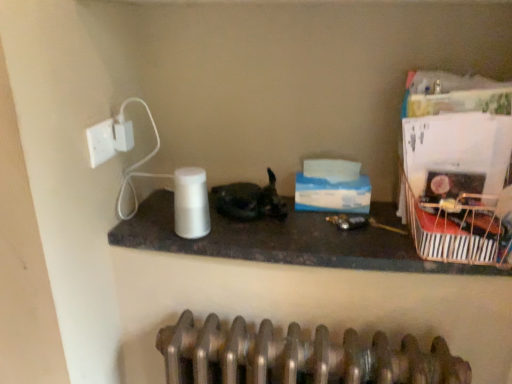
At what (x,y) coordinates should I click in order to perform the action: click on white matte paper towel at center. Please return your answer as a coordinate pair (x, y). Looking at the image, I should click on (191, 203).

In order to face white plastic electric outlet at upper left, should I rotate leftwards or rightwards?

To face it directly, rotate left by 16.937 degrees.

What do you see at coordinates (249, 200) in the screenshot? I see `shiny black cat at center` at bounding box center [249, 200].

Locate an element on the screen. metallic striped basket at right is located at coordinates (455, 230).

Find the location of a particular element. white glossy speaker at center is located at coordinates (287, 240).

At what (x,y) coordinates should I click in order to perform the action: click on basket to the right of white matte paper towel at center. Please return your answer as a coordinate pair (x, y). This screenshot has width=512, height=384. Looking at the image, I should click on pyautogui.click(x=455, y=230).

Is metallic striped basket at right behind white matte paper towel at center?

No, metallic striped basket at right is in front of white matte paper towel at center.

Based on the photo, how many degrees apart are the facing directions of metallic striped basket at right and white matte paper towel at center?

→ The angular difference between metallic striped basket at right and white matte paper towel at center is 0.000851 degrees.

Would you consider metallic striped basket at right to be distant from white matte paper towel at center?

Actually, metallic striped basket at right and white matte paper towel at center are a little close together.

From the image's perspective, would you say white matte paper towel at center is positioned over white plastic socket at upper left?

No, from the image's perspective, white matte paper towel at center is not over white plastic socket at upper left.

Measure the distance from white matte paper towel at center to white plastic socket at upper left.

They are 20.62 centimeters apart.

From a real-world perspective, does white matte paper towel at center sit lower than white plastic socket at upper left?

Yes.

Is white matte paper towel at center in contact with white plastic socket at upper left?

No, white matte paper towel at center is not next to white plastic socket at upper left.

Does metallic striped basket at right turn towards white plastic electric outlet at upper left?

No, metallic striped basket at right does not turn towards white plastic electric outlet at upper left.

Considering the sizes of objects metallic striped basket at right and white plastic electric outlet at upper left in the image provided, who is taller, metallic striped basket at right or white plastic electric outlet at upper left?

metallic striped basket at right is taller.

Does metallic striped basket at right lie in front of white plastic electric outlet at upper left?

Yes, metallic striped basket at right is closer to the viewer.

Visually, is metallic striped basket at right positioned to the left or to the right of white glossy speaker at center?

Based on their positions, metallic striped basket at right is located to the right of white glossy speaker at center.

From a real-world perspective, which object stands above the other?

metallic striped basket at right.

From the image's perspective, which is above, metallic striped basket at right or white glossy speaker at center?

metallic striped basket at right.

Is metallic striped basket at right turned away from white glossy speaker at center?

That's not correct — metallic striped basket at right is not looking away from white glossy speaker at center.

Identify the location of electric outlet that appears above the white plastic socket at upper left (from the image's perspective). (123, 136).

Would you consider white plastic socket at upper left to be distant from white plastic electric outlet at upper left?

No, white plastic socket at upper left is in close proximity to white plastic electric outlet at upper left.

From a real-world perspective, is white plastic socket at upper left over white plastic electric outlet at upper left?

No, from a real-world perspective, white plastic socket at upper left is not above white plastic electric outlet at upper left.

How many degrees apart are the facing directions of shiny black cat at center and white matte paper towel at center?

The facing directions of shiny black cat at center and white matte paper towel at center are 0.00292 degrees apart.

Image resolution: width=512 pixels, height=384 pixels. I want to click on cat above the white matte paper towel at center (from the image's perspective), so click(249, 200).

Would you say shiny black cat at center is a long distance from white matte paper towel at center?

They are positioned close to each other.

Considering the sizes of objects shiny black cat at center and white matte paper towel at center in the image provided, who is bigger, shiny black cat at center or white matte paper towel at center?

With larger size is shiny black cat at center.

Is white matte paper towel at center not within white plastic electric outlet at upper left?

white matte paper towel at center lies outside white plastic electric outlet at upper left's area.

In the scene shown: Which is more to the right, white matte paper towel at center or white plastic electric outlet at upper left?

white matte paper towel at center is more to the right.

From a real-world perspective, is white matte paper towel at center physically above white plastic electric outlet at upper left?

No.

This screenshot has height=384, width=512. I want to click on paper towel positioned vertically above the metallic striped basket at right (from a real-world perspective), so click(x=191, y=203).

The width and height of the screenshot is (512, 384). Find the location of `socket that appears in front of the white matte paper towel at center`. socket that appears in front of the white matte paper towel at center is located at coordinates (101, 142).

When comparing their distances from white glossy speaker at center, does shiny black cat at center or white plastic electric outlet at upper left seem further?

white plastic electric outlet at upper left is positioned further to the anchor white glossy speaker at center.

When comparing their distances from white plastic electric outlet at upper left, does metallic striped basket at right or white matte paper towel at center seem closer?

white matte paper towel at center is positioned closer to the anchor white plastic electric outlet at upper left.

Based on their spatial positions, is white plastic socket at upper left or white plastic electric outlet at upper left closer to white glossy speaker at center?

Based on the image, white plastic socket at upper left appears to be nearer to white glossy speaker at center.

Estimate the real-world distances between objects in this image. Which object is closer to shiny black cat at center, white glossy speaker at center or metallic striped basket at right?

white glossy speaker at center is closer to shiny black cat at center.

Consider the image. Looking at the image, which one is located further to metallic striped basket at right, white plastic electric outlet at upper left or shiny black cat at center?

white plastic electric outlet at upper left is positioned further to the anchor metallic striped basket at right.

Looking at this image, looking at the image, which one is located closer to white plastic socket at upper left, metallic striped basket at right or white glossy speaker at center?

white glossy speaker at center.

When comparing their distances from metallic striped basket at right, does white plastic electric outlet at upper left or white glossy speaker at center seem closer?

white glossy speaker at center lies closer to metallic striped basket at right than the other object.

Based on their spatial positions, is white plastic socket at upper left or white glossy speaker at center further from white matte paper towel at center?

Among the two, white plastic socket at upper left is located further to white matte paper towel at center.

In order to click on cat between white matte paper towel at center and white glossy speaker at center from left to right in this screenshot , I will do `click(249, 200)`.

You are a GUI agent. You are given a task and a screenshot of the screen. Output one action in this format:
    pyautogui.click(x=<x>, y=<y>)
    Task: Click on the paper towel between white plastic electric outlet at upper left and white glossy speaker at center from left to right
    This screenshot has height=384, width=512.
    Given the screenshot: What is the action you would take?
    pyautogui.click(x=191, y=203)

You are a GUI agent. You are given a task and a screenshot of the screen. Output one action in this format:
    pyautogui.click(x=<x>, y=<y>)
    Task: Click on the paper towel situated between white plastic electric outlet at upper left and shiny black cat at center from left to right
    This screenshot has height=384, width=512.
    Given the screenshot: What is the action you would take?
    pyautogui.click(x=191, y=203)

The height and width of the screenshot is (384, 512). What are the coordinates of `counter top situated between white matte paper towel at center and metallic striped basket at right from left to right` in the screenshot? It's located at (287, 240).